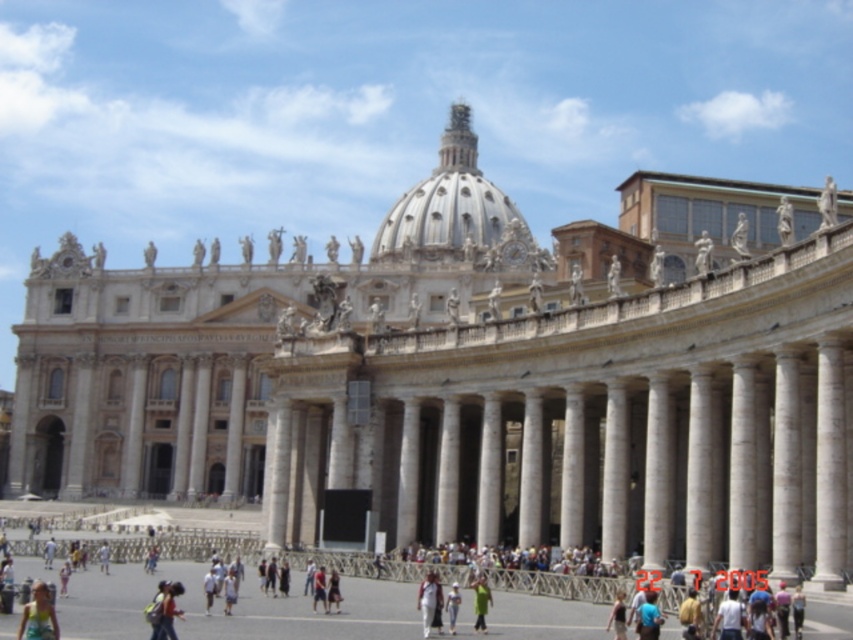
Can you confirm if light yellow fabric dress at lower left is positioned below light brown fabric bag at lower center?

Actually, light yellow fabric dress at lower left is above light brown fabric bag at lower center.

Which is in front, point (44, 596) or point (432, 611)?

Positioned in front is point (44, 596).

Identify the location of light yellow fabric dress at lower left. (38, 616).

Who is shorter, blue fabric shirt at center or light blue denim jeans at center?

Standing shorter between the two is blue fabric shirt at center.

What do you see at coordinates (648, 618) in the screenshot?
I see `blue fabric shirt at center` at bounding box center [648, 618].

Where is `blue fabric shirt at center`? blue fabric shirt at center is located at coordinates (648, 618).

Does light brown fabric bag at lower center have a lesser height compared to blue fabric shirt at center?

Yes, light brown fabric bag at lower center is shorter than blue fabric shirt at center.

Can you confirm if light brown fabric bag at lower center is bigger than blue fabric shirt at center?

No.

Measure the distance between light brown fabric bag at lower center and camera.

light brown fabric bag at lower center is 31.99 meters away from camera.

Identify the location of light brown fabric bag at lower center. The image size is (853, 640). (430, 604).